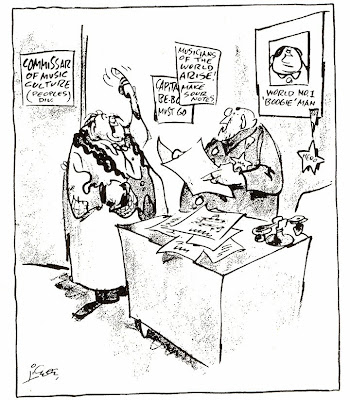
Find the location of `desk ornament`. desk ornament is located at coordinates (281, 241).